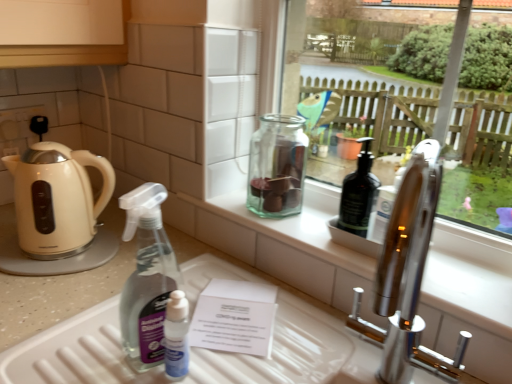
Question: From the image's perspective, does beige glossy kettle at left appear lower than white plastic tray at lower center?

Choices:
 (A) no
 (B) yes

Answer: (A)

Question: Does beige glossy kettle at left have a lesser width compared to white plastic tray at lower center?

Choices:
 (A) no
 (B) yes

Answer: (B)

Question: Is beige glossy kettle at left outside of white plastic tray at lower center?

Choices:
 (A) no
 (B) yes

Answer: (B)

Question: Is beige glossy kettle at left further to camera compared to white plastic tray at lower center?

Choices:
 (A) no
 (B) yes

Answer: (B)

Question: Can you confirm if beige glossy kettle at left is wider than white plastic tray at lower center?

Choices:
 (A) no
 (B) yes

Answer: (A)

Question: From a real-world perspective, is beige glossy kettle at left beneath white plastic tray at lower center?

Choices:
 (A) no
 (B) yes

Answer: (A)

Question: From the image's perspective, is white plastic tray at lower center on top of beige glossy kettle at left?

Choices:
 (A) no
 (B) yes

Answer: (A)

Question: Can you confirm if white plastic tray at lower center is bigger than beige glossy kettle at left?

Choices:
 (A) yes
 (B) no

Answer: (A)

Question: From a real-world perspective, does white plastic tray at lower center stand above beige glossy kettle at left?

Choices:
 (A) no
 (B) yes

Answer: (A)

Question: Can you confirm if white plastic tray at lower center is shorter than beige glossy kettle at left?

Choices:
 (A) no
 (B) yes

Answer: (B)

Question: Is white plastic tray at lower center behind beige glossy kettle at left?

Choices:
 (A) yes
 (B) no

Answer: (B)

Question: From a real-world perspective, is white plastic tray at lower center located beneath beige glossy kettle at left?

Choices:
 (A) no
 (B) yes

Answer: (B)

Question: From a real-world perspective, is white plastic tray at lower center physically above green glass jar at center?

Choices:
 (A) yes
 (B) no

Answer: (B)